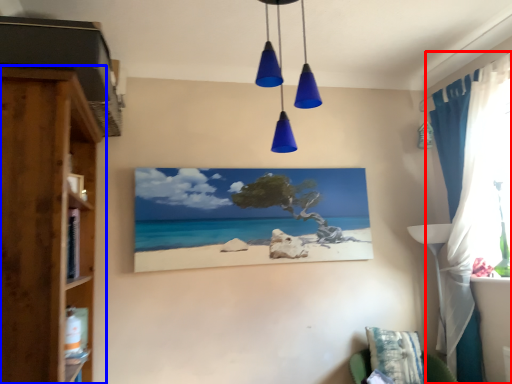
Question: Which object is closer to the camera taking this photo, curtain (highlighted by a red box) or cupboard (highlighted by a blue box)?

Choices:
 (A) curtain
 (B) cupboard

Answer: (B)